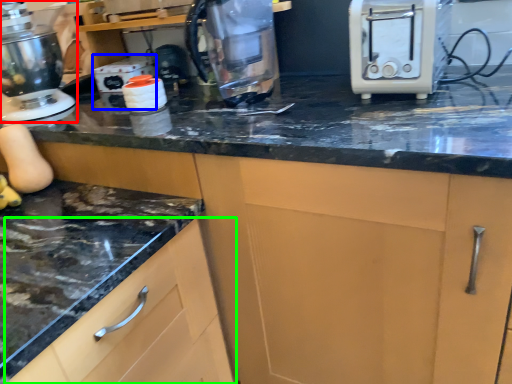
Question: Which is farther away from home appliance (highlighted by a red box)? appliance (highlighted by a blue box) or cabinetry (highlighted by a green box)?

Choices:
 (A) appliance
 (B) cabinetry

Answer: (B)